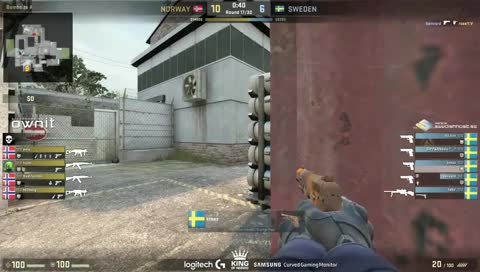
Find the location of a particular element. vent is located at coordinates click(x=188, y=100).